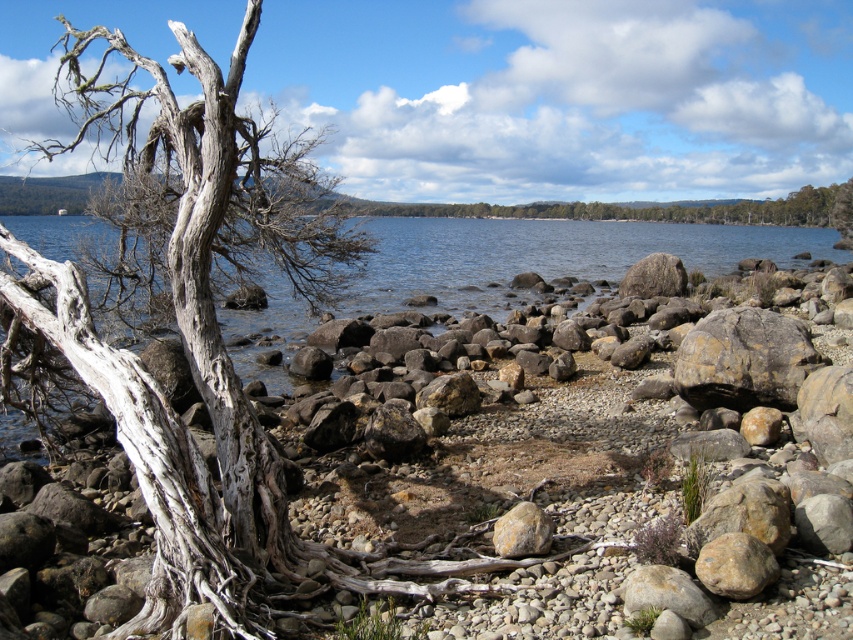
You are a geologist examining the rocks at the lakeside. You have a ruler and need to measure the thickness of the rusty metallic rock at lower right and the gray rough rock at lower right. Which rock requires a longer ruler to measure its thickness?

The gray rough rock at lower right requires a longer ruler because it is thicker than the rusty metallic rock at lower right.

You are standing at the center of the lakeside scene. You want to pick up the white textured driftwood at left. According to the coordinates provided, is the driftwood closer to the water or the shoreline?

The white textured driftwood at left is located at point [189,310]. Since the coordinates are closer to the water edge, the driftwood is closer to the water than the shoreline.